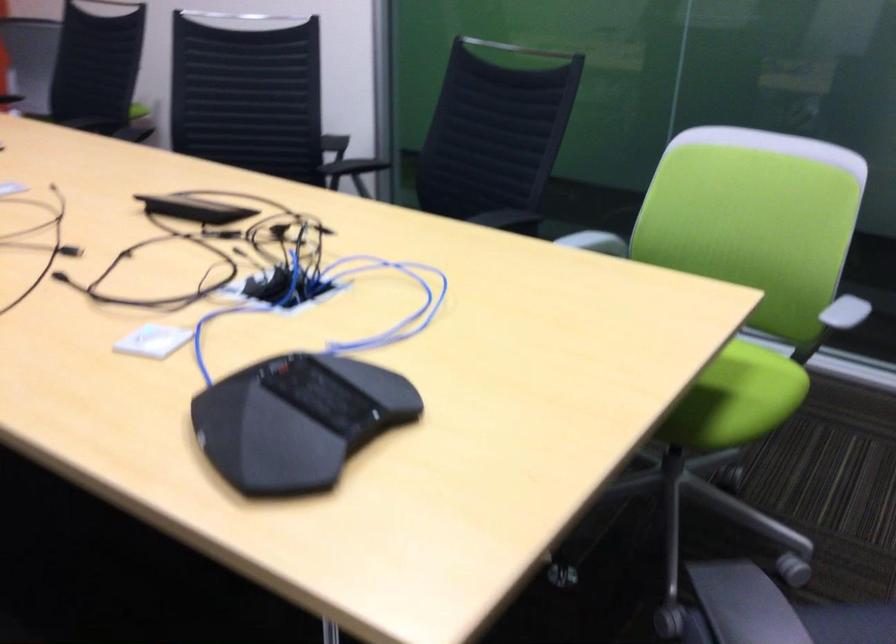
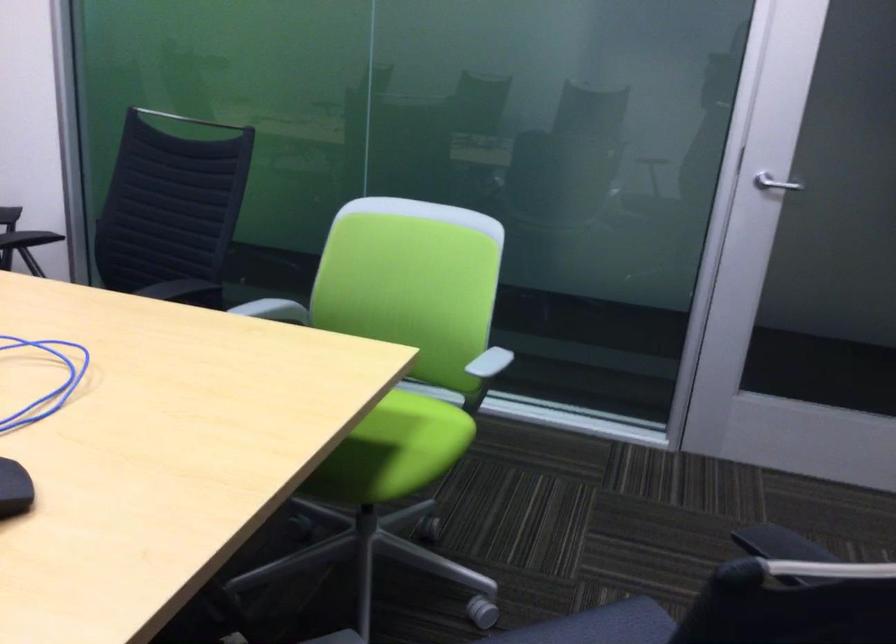
In a continuous first-person perspective shot, in which direction is the camera moving?

The movement direction of the cameraman is right, backward.